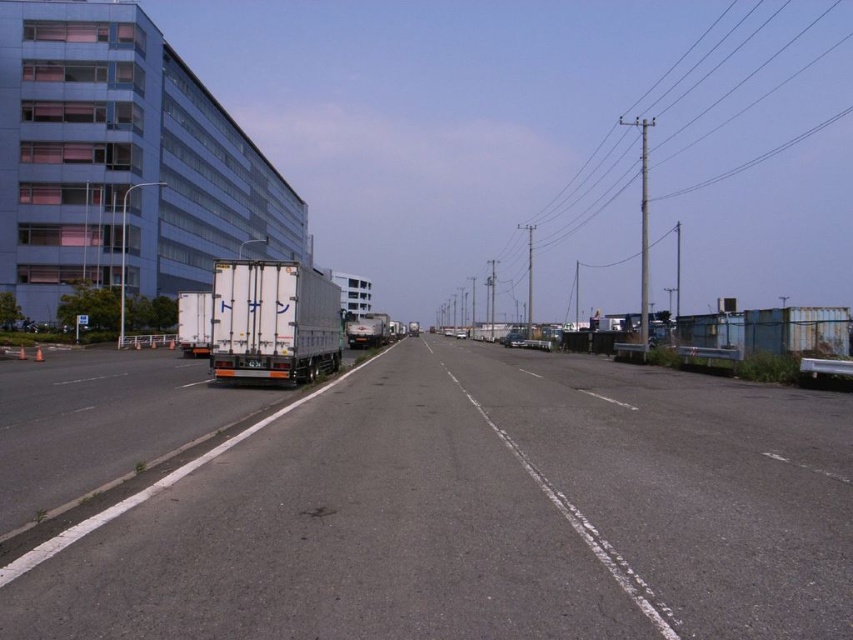
Question: Considering the relative positions of black asphalt highway at center and white matte trailer truck at center in the image provided, where is black asphalt highway at center located with respect to white matte trailer truck at center?

Choices:
 (A) above
 (B) below

Answer: (B)

Question: Which point appears closest to the camera in this image?

Choices:
 (A) click(x=683, y=593)
 (B) click(x=270, y=305)

Answer: (A)

Question: Does black asphalt highway at center have a greater width compared to white matte trailer truck at center?

Choices:
 (A) no
 (B) yes

Answer: (B)

Question: Which of the following is the closest to the observer?

Choices:
 (A) click(265, 369)
 (B) click(764, 509)

Answer: (B)

Question: Does black asphalt highway at center have a greater width compared to white matte trailer truck at center?

Choices:
 (A) no
 (B) yes

Answer: (B)